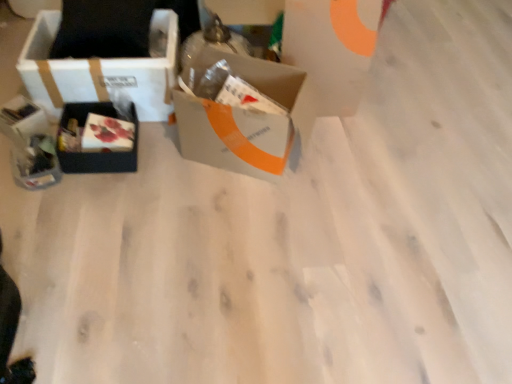
You are a GUI agent. You are given a task and a screenshot of the screen. Output one action in this format:
    pyautogui.click(x=<x>, y=<y>)
    Task: Click on the free space in front of matte black gift box at left, the second gift box viewed from the top
    This screenshot has height=384, width=512.
    Given the screenshot: What is the action you would take?
    pyautogui.click(x=31, y=204)